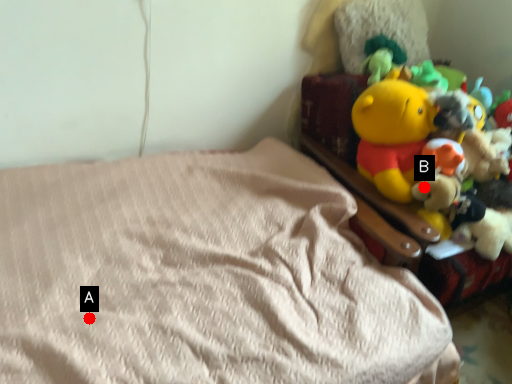
Question: Two points are circled on the image, labeled by A and B beside each circle. Which point appears farthest from the camera in this image?

Choices:
 (A) A is further
 (B) B is further

Answer: (B)